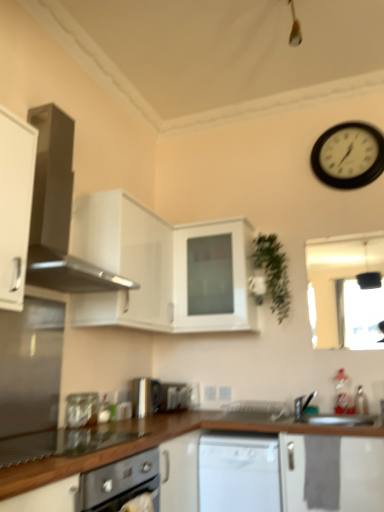
Question: Does green matte plant at upper right have a smaller size compared to satin silver toaster at center, the first appliance viewed from the back?

Choices:
 (A) no
 (B) yes

Answer: (A)

Question: From a real-world perspective, does green matte plant at upper right stand above satin silver toaster at center, the first appliance viewed from the back?

Choices:
 (A) no
 (B) yes

Answer: (B)

Question: Does green matte plant at upper right have a lesser width compared to satin silver toaster at center, which appears as the 1th appliance when viewed from the right?

Choices:
 (A) yes
 (B) no

Answer: (B)

Question: Is satin silver toaster at center, the third appliance viewed from the left, inside green matte plant at upper right?

Choices:
 (A) yes
 (B) no

Answer: (B)

Question: Does green matte plant at upper right appear on the right side of satin silver toaster at center, which is the 3th appliance in front-to-back order?

Choices:
 (A) yes
 (B) no

Answer: (A)

Question: From a real-world perspective, is satin silver toaster at lower center, positioned as the second appliance in back-to-front order, positioned above or below brown wood countertop at lower center?

Choices:
 (A) above
 (B) below

Answer: (A)

Question: From the image's perspective, is satin silver toaster at lower center, positioned as the 2th appliance in right-to-left order, located above or below brown wood countertop at lower center?

Choices:
 (A) above
 (B) below

Answer: (A)

Question: Which is correct: satin silver toaster at lower center, which is the second appliance in left-to-right order, is inside brown wood countertop at lower center, or outside of it?

Choices:
 (A) inside
 (B) outside

Answer: (B)

Question: Is satin silver toaster at lower center, arranged as the 2th appliance when viewed from the front, to the left or to the right of brown wood countertop at lower center in the image?

Choices:
 (A) right
 (B) left

Answer: (A)

Question: Which is correct: clear glass jar at lower left, placed as the first appliance when sorted from front to back, is inside white glossy cabinet at upper center, positioned as the 2th cabinetry in back-to-front order, or outside of it?

Choices:
 (A) outside
 (B) inside

Answer: (A)

Question: In terms of width, does clear glass jar at lower left, which is counted as the third appliance, starting from the back, look wider or thinner when compared to white glossy cabinet at upper center, positioned as the 2th cabinetry in front-to-back order?

Choices:
 (A) thin
 (B) wide

Answer: (A)

Question: Relative to white glossy cabinet at upper center, positioned as the 2th cabinetry in front-to-back order, is clear glass jar at lower left, placed as the first appliance when sorted from front to back, in front or behind?

Choices:
 (A) behind
 (B) front

Answer: (A)

Question: Is clear glass jar at lower left, which is the third appliance in right-to-left order, taller or shorter than white glossy cabinet at upper center, positioned as the 2th cabinetry in back-to-front order?

Choices:
 (A) tall
 (B) short

Answer: (B)

Question: Considering their positions, is black plastic wall clock at upper right located in front of or behind white glossy dishwasher at center?

Choices:
 (A) behind
 (B) front

Answer: (A)

Question: From the image's perspective, relative to white glossy dishwasher at center, is black plastic wall clock at upper right above or below?

Choices:
 (A) above
 (B) below

Answer: (A)